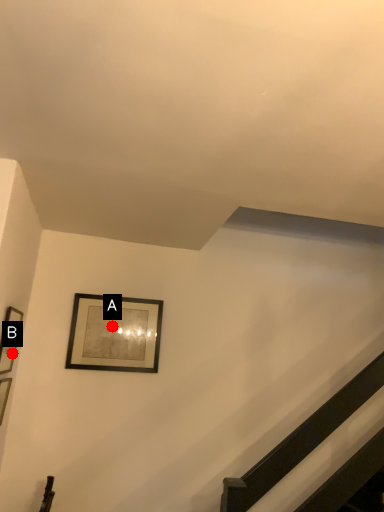
Question: Two points are circled on the image, labeled by A and B beside each circle. Which point is closer to the camera?

Choices:
 (A) A is closer
 (B) B is closer

Answer: (B)